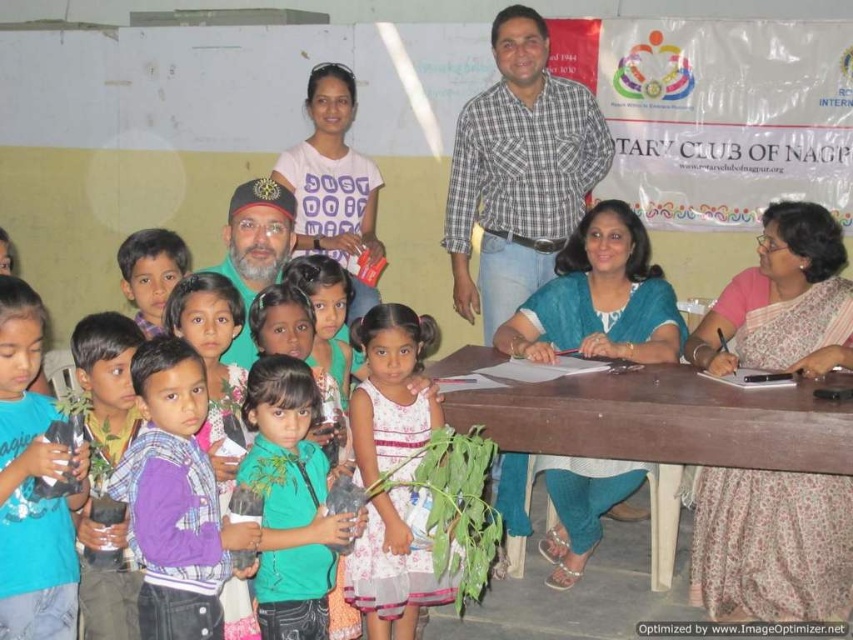
You are a photographer standing at the back of the room. You need to take a photo of the wooden table at lower center and the blue cotton shirt at center. Which object is closer to the camera?

The blue cotton shirt at center is closer to the camera because the wooden table at lower center is shorter than it.

You are a photographer standing at the back of the room. You need to take a photo of the wooden table at lower center and the blue cotton shirt at center. How far apart are these two objects from each other?

The wooden table at lower center is 1.12 meters from the blue cotton shirt at center.

You are standing in the room where the group photo was taken. You want to place a gift on the wooden table at lower center. However, there is a blue cotton shirt at center in the way. Can you place the gift on the table without moving the shirt?

The wooden table at lower center is below the blue cotton shirt at center, so you can place the gift on the wooden table at lower center since it is positioned under the shirt and not blocking the table surface.